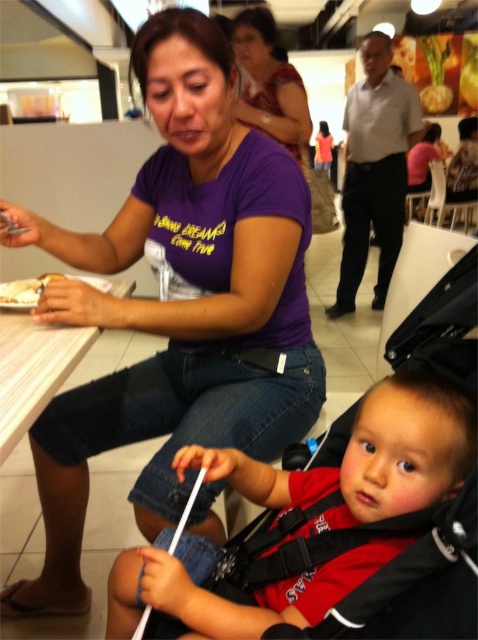
Is point (25, 420) behind point (41, 288)?

No, it is in front of (41, 288).

Does white wood table at lower left appear on the left side of white matte plate at lower left?

No, white wood table at lower left is not to the left of white matte plate at lower left.

Identify the location of white wood table at lower left. (32, 369).

This screenshot has height=640, width=478. Find the location of `matte purple shirt at upper center`. matte purple shirt at upper center is located at coordinates (269, 83).

Which is in front, point (231, 22) or point (8, 292)?

Positioned in front is point (8, 292).

Does point (286, 120) come in front of point (7, 291)?

No, (286, 120) is further to viewer.

The image size is (478, 640). I want to click on matte purple shirt at upper center, so 269,83.

Which is more to the right, white wood table at lower left or matte purple shirt at upper center?

From the viewer's perspective, matte purple shirt at upper center appears more on the right side.

Is white wood table at lower left above matte purple shirt at upper center?

No, white wood table at lower left is not above matte purple shirt at upper center.

Is point (25, 330) positioned before point (304, 145)?

Yes, point (25, 330) is closer to viewer.

The height and width of the screenshot is (640, 478). In order to click on white wood table at lower left in this screenshot , I will do `click(32, 369)`.